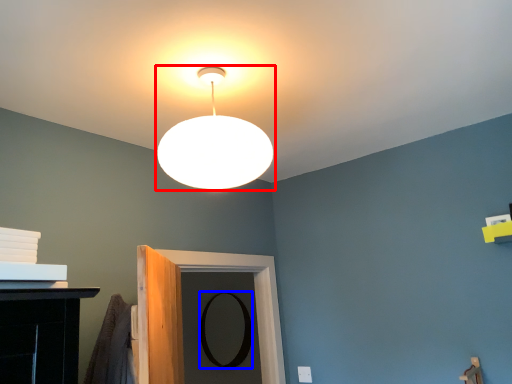
Question: Which object is closer to the camera taking this photo, lamp (highlighted by a red box) or mirror (highlighted by a blue box)?

Choices:
 (A) lamp
 (B) mirror

Answer: (A)